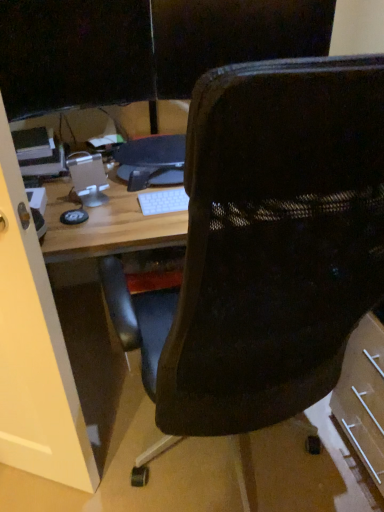
This screenshot has height=512, width=384. I want to click on free spot above black plastic monitor at center (from a real-world perspective), so click(x=144, y=153).